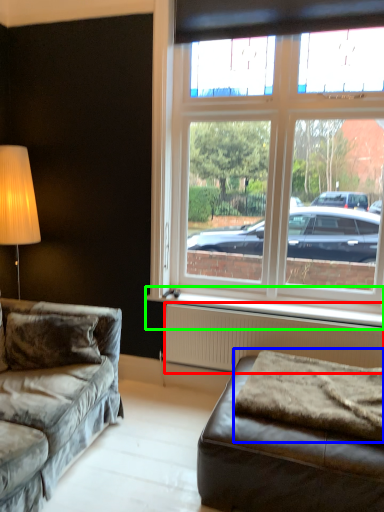
Question: Which is nearer to the radiator (highlighted by a red box)? blanket (highlighted by a blue box) or window sill (highlighted by a green box).

Choices:
 (A) blanket
 (B) window sill

Answer: (B)